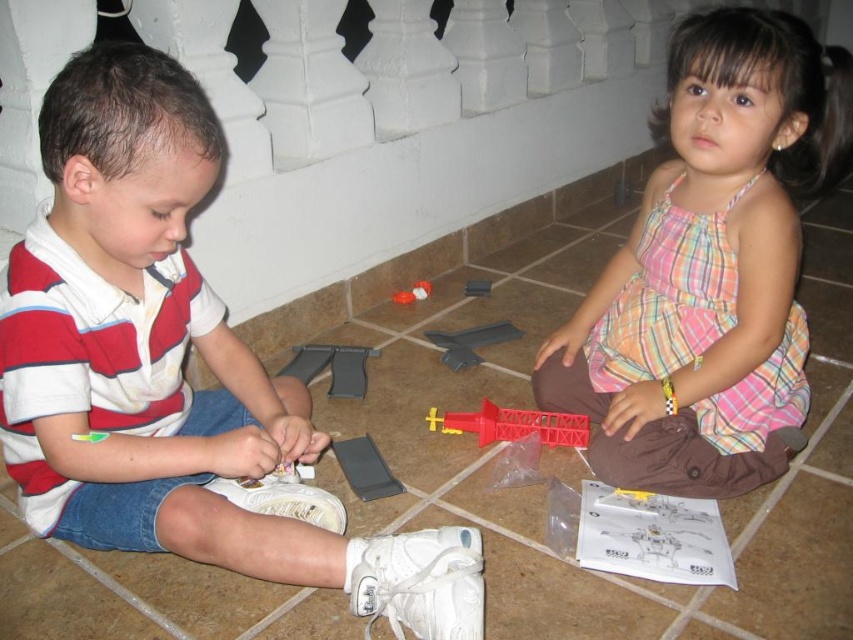
You are a robot trying to navigate between two points in the scene. The first point is point (724, 396) and the second is point (334, 371). According to the scene description, which point is closer to the observer?

Point (724, 396) is in front of point (334, 371), so it is closer to the observer.

You are a parent observing your children playing with the red plastic tower at center and the red plastic toy at center. Which one do you think is taller?

The red plastic tower at center is much taller than the red plastic toy at center.

You are a parent who wants to ensure the safety of your children while they play. The red plastic tower at center and the matte plastic toy at center are on the floor. If you want to place a safety mat between them, what is the minimum length of the mat required to cover the space between them?

The minimum length of the safety mat required to cover the space between the red plastic tower at center and the matte plastic toy at center should be at least 13.13 inches, as that is the distance between them.